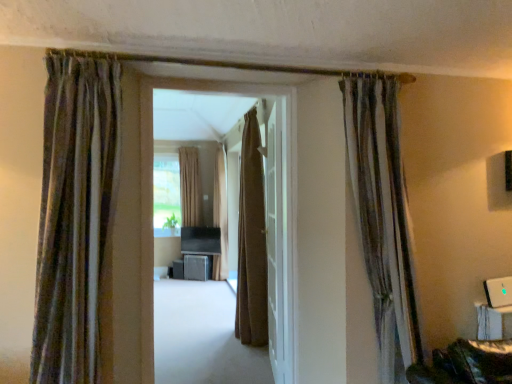
Question: Can you see metallic gray cabinet at center, which appears as the 2th furniture when viewed from the left, touching brown textured curtain at center, the third curtain in the right-to-left sequence?

Choices:
 (A) no
 (B) yes

Answer: (A)

Question: Considering the relative positions of metallic gray cabinet at center, the 1th furniture in the right-to-left sequence, and brown textured curtain at center, the second curtain in the back-to-front sequence, in the image provided, is metallic gray cabinet at center, the 1th furniture in the right-to-left sequence, to the left of brown textured curtain at center, the second curtain in the back-to-front sequence, from the viewer's perspective?

Choices:
 (A) no
 (B) yes

Answer: (B)

Question: Does metallic gray cabinet at center, which appears as the 2th furniture when viewed from the left, come in front of brown textured curtain at center, the third curtain in the right-to-left sequence?

Choices:
 (A) no
 (B) yes

Answer: (A)

Question: Does metallic gray cabinet at center, the 1th furniture in the right-to-left sequence, have a smaller size compared to brown textured curtain at center, the second curtain in the back-to-front sequence?

Choices:
 (A) no
 (B) yes

Answer: (B)

Question: Can you confirm if metallic gray cabinet at center, which appears as the 2th furniture when viewed from the left, is bigger than brown textured curtain at center, the second curtain in the back-to-front sequence?

Choices:
 (A) no
 (B) yes

Answer: (A)

Question: Visually, is striped velvet curtain at left, the second curtain from the left, positioned to the left or to the right of white glossy door at center?

Choices:
 (A) right
 (B) left

Answer: (B)

Question: In the image, is striped velvet curtain at left, which appears as the fourth curtain when viewed from the right, positioned in front of or behind white glossy door at center?

Choices:
 (A) behind
 (B) front

Answer: (B)

Question: From a real-world perspective, is striped velvet curtain at left, which appears as the fourth curtain when viewed from the right, positioned above or below white glossy door at center?

Choices:
 (A) above
 (B) below

Answer: (A)

Question: Is point (103, 172) closer or farther from the camera than point (274, 182)?

Choices:
 (A) closer
 (B) farther

Answer: (A)

Question: Is matte brown carpet at center in front of or behind brown fabric curtain at center, the 3th curtain from the front, in the image?

Choices:
 (A) behind
 (B) front

Answer: (B)

Question: Is point (291, 281) closer or farther from the camera than point (260, 326)?

Choices:
 (A) closer
 (B) farther

Answer: (A)

Question: Is matte brown carpet at center bigger or smaller than brown fabric curtain at center, which ranks as the third curtain in back-to-front order?

Choices:
 (A) big
 (B) small

Answer: (B)

Question: Is matte brown carpet at center inside the boundaries of brown fabric curtain at center, which ranks as the third curtain in back-to-front order, or outside?

Choices:
 (A) outside
 (B) inside

Answer: (A)

Question: From a real-world perspective, relative to metallic gray cabinet at center, the 1th furniture in the right-to-left sequence, is brown textured curtain at center, the third curtain in the right-to-left sequence, vertically above or below?

Choices:
 (A) below
 (B) above

Answer: (B)

Question: Is point (221, 163) positioned closer to the camera than point (189, 276)?

Choices:
 (A) closer
 (B) farther

Answer: (B)